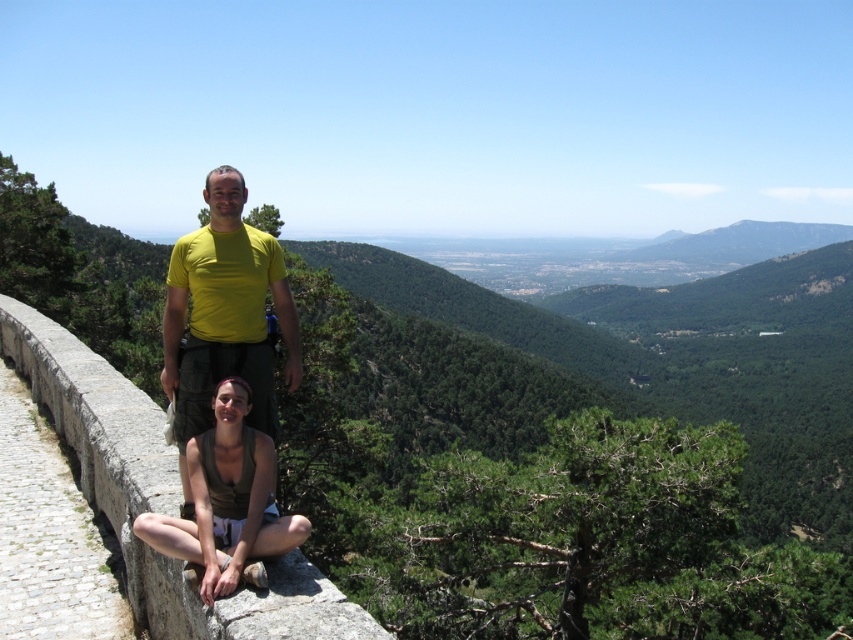
Question: From the image, what is the correct spatial relationship of gray stone ledge at center in relation to green fabric tank top at lower center?

Choices:
 (A) below
 (B) above

Answer: (B)

Question: Observing the image, what is the correct spatial positioning of gray stone ledge at center in reference to yellow matte t-shirt at center?

Choices:
 (A) below
 (B) above

Answer: (A)

Question: Is gray stone ledge at center positioned at the back of yellow matte t-shirt at center?

Choices:
 (A) yes
 (B) no

Answer: (B)

Question: Among these points, which one is farthest from the camera?

Choices:
 (A) (209, 461)
 (B) (239, 253)

Answer: (B)

Question: Which point is farther from the camera taking this photo?

Choices:
 (A) click(251, 477)
 (B) click(68, 355)
 (C) click(166, 310)

Answer: (B)

Question: Which object is closer to the camera taking this photo?

Choices:
 (A) green fabric tank top at lower center
 (B) gray stone ledge at center

Answer: (B)